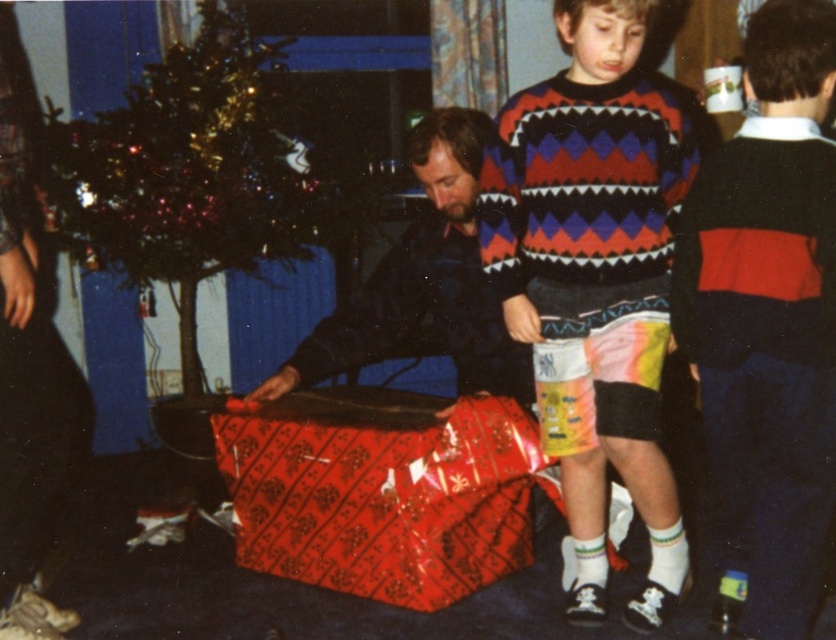
Can you confirm if shiny green christmas tree at left is taller than dark blue sweater at center?

Yes.

Which is more to the left, shiny green christmas tree at left or dark blue sweater at center?

Positioned to the left is shiny green christmas tree at left.

Who is more distant from viewer, (228, 77) or (424, 332)?

Positioned behind is point (424, 332).

This screenshot has height=640, width=836. I want to click on shiny green christmas tree at left, so click(187, 170).

Can you confirm if red sweater at center is taller than dark blue sweater at center?

Yes, red sweater at center is taller than dark blue sweater at center.

Is point (760, 582) positioned in front of point (513, 385)?

That is True.

Is point (766, 301) positioned in front of point (492, 321)?

Yes.

Image resolution: width=836 pixels, height=640 pixels. Find the location of `red sweater at center`. red sweater at center is located at coordinates (768, 317).

Does knitted sweater at center appear on the right side of dark blue sweater at center?

Indeed, knitted sweater at center is positioned on the right side of dark blue sweater at center.

Is knitted sweater at center above dark blue sweater at center?

No, knitted sweater at center is not above dark blue sweater at center.

Image resolution: width=836 pixels, height=640 pixels. Describe the element at coordinates (595, 280) in the screenshot. I see `knitted sweater at center` at that location.

Identify the location of knitted sweater at center. (595, 280).